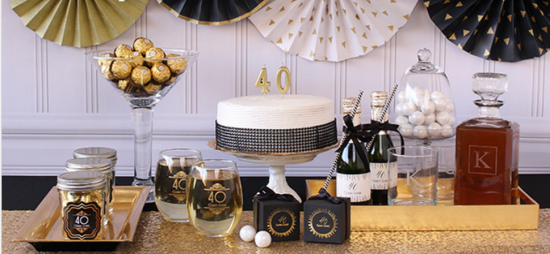
Identify the location of liquor contianer. This screenshot has width=550, height=254. (493, 141).